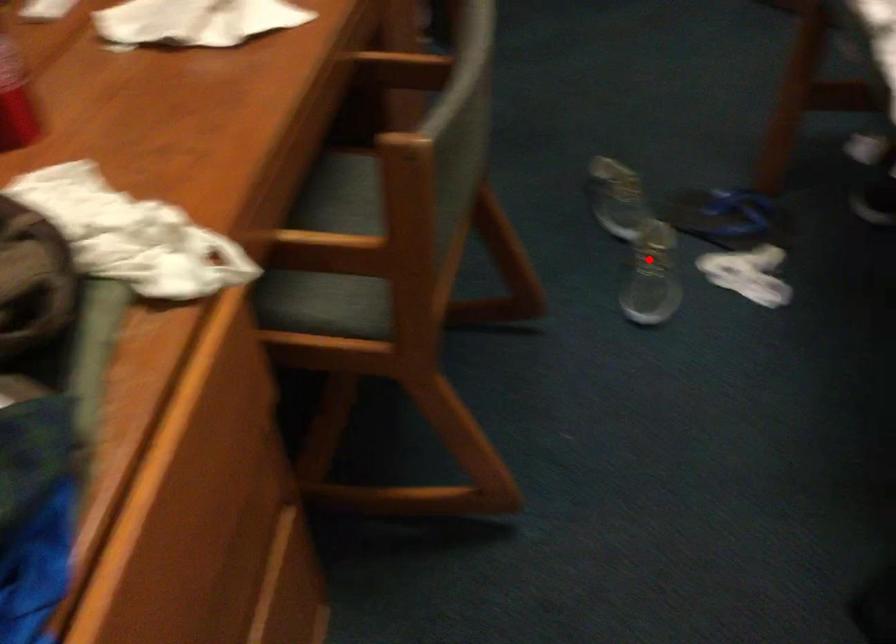
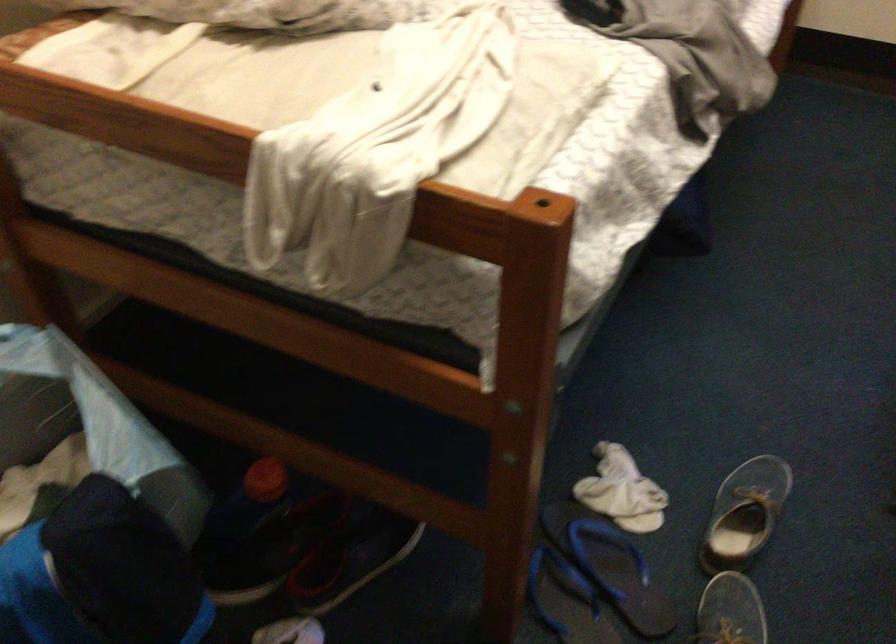
Question: I am providing you with two images of the same scene from different viewpoints. A red point is shown in image1. For the corresponding object point in image2, is it positioned nearer or farther from the camera?

Choices:
 (A) Nearer
 (B) Farther

Answer: (A)